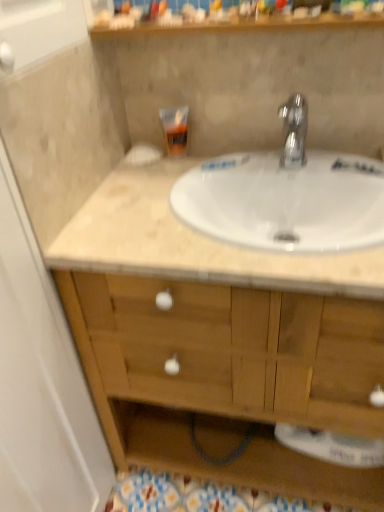
Question: Is wooden shelf at upper center to the right of polished chrome faucet at upper center from the viewer's perspective?

Choices:
 (A) no
 (B) yes

Answer: (A)

Question: From the image's perspective, is wooden shelf at upper center on polished chrome faucet at upper center?

Choices:
 (A) yes
 (B) no

Answer: (A)

Question: Are wooden shelf at upper center and polished chrome faucet at upper center located far from each other?

Choices:
 (A) yes
 (B) no

Answer: (B)

Question: From a real-world perspective, is wooden shelf at upper center positioned over polished chrome faucet at upper center based on gravity?

Choices:
 (A) no
 (B) yes

Answer: (B)

Question: Can you confirm if wooden shelf at upper center is wider than polished chrome faucet at upper center?

Choices:
 (A) no
 (B) yes

Answer: (B)

Question: Is white marble sink at center bigger or smaller than translucent plastic tube at upper center?

Choices:
 (A) big
 (B) small

Answer: (A)

Question: Considering the positions of point (278, 244) and point (168, 143), is point (278, 244) closer or farther from the camera than point (168, 143)?

Choices:
 (A) closer
 (B) farther

Answer: (A)

Question: From the image's perspective, is white marble sink at center located above or below translucent plastic tube at upper center?

Choices:
 (A) below
 (B) above

Answer: (A)

Question: Choose the correct answer: Is white marble sink at center inside translucent plastic tube at upper center or outside it?

Choices:
 (A) outside
 (B) inside

Answer: (A)

Question: From their relative heights in the image, would you say wooden shelf at upper center is taller or shorter than white marble sink at center?

Choices:
 (A) short
 (B) tall

Answer: (A)

Question: In the image, is wooden shelf at upper center on the left side or the right side of white marble sink at center?

Choices:
 (A) left
 (B) right

Answer: (A)

Question: Is point (112, 29) positioned closer to the camera than point (150, 165)?

Choices:
 (A) closer
 (B) farther

Answer: (A)

Question: Is wooden shelf at upper center bigger or smaller than white marble sink at center?

Choices:
 (A) small
 (B) big

Answer: (A)

Question: Looking at their shapes, would you say polished chrome faucet at upper center is wider or thinner than wooden cabinet at center?

Choices:
 (A) wide
 (B) thin

Answer: (B)

Question: Based on their positions, is polished chrome faucet at upper center located to the left or right of wooden cabinet at center?

Choices:
 (A) left
 (B) right

Answer: (B)